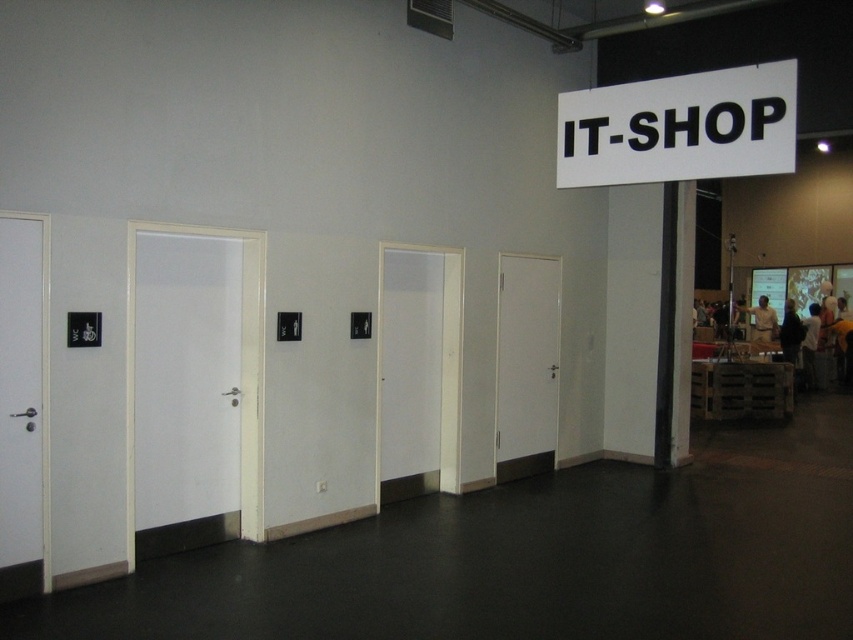
Question: Which of the following is the farthest from the observer?

Choices:
 (A) white glossy door at left
 (B) white matte door at center
 (C) white matte door at left
 (D) white plastic sign at upper center

Answer: (B)

Question: Can you confirm if white plastic sign at upper center is positioned to the left of white matte door at center?

Choices:
 (A) no
 (B) yes

Answer: (A)

Question: Which object appears farthest from the camera in this image?

Choices:
 (A) white matte door at left
 (B) white plastic sign at upper center
 (C) white matte door at center
 (D) white glossy door at left

Answer: (C)

Question: Which is farther from the white plastic sign at upper center?

Choices:
 (A) white matte door at left
 (B) white glossy door at left

Answer: (B)

Question: Is white matte door at left smaller than white plastic sign at upper center?

Choices:
 (A) yes
 (B) no

Answer: (B)

Question: Is white matte door at left in front of white plastic sign at upper center?

Choices:
 (A) yes
 (B) no

Answer: (B)